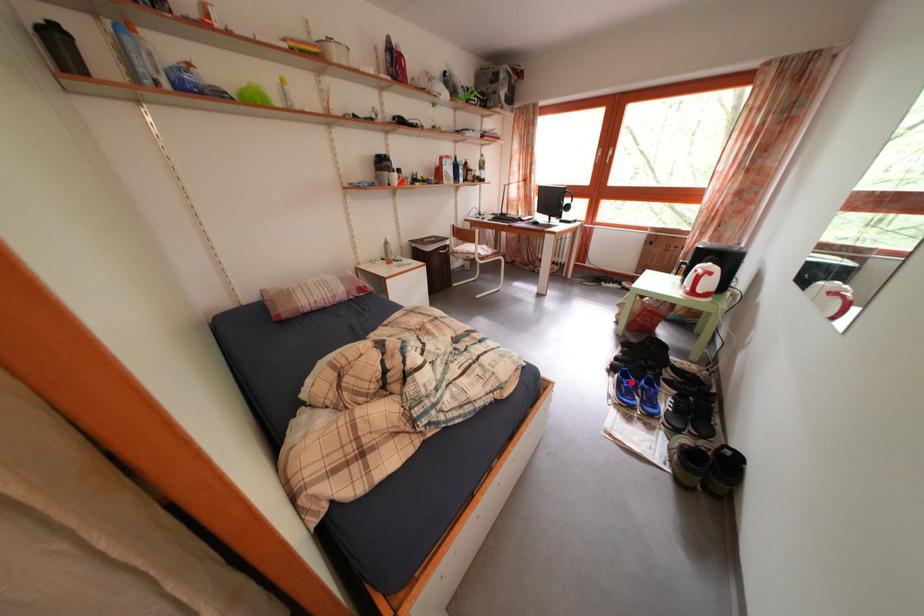
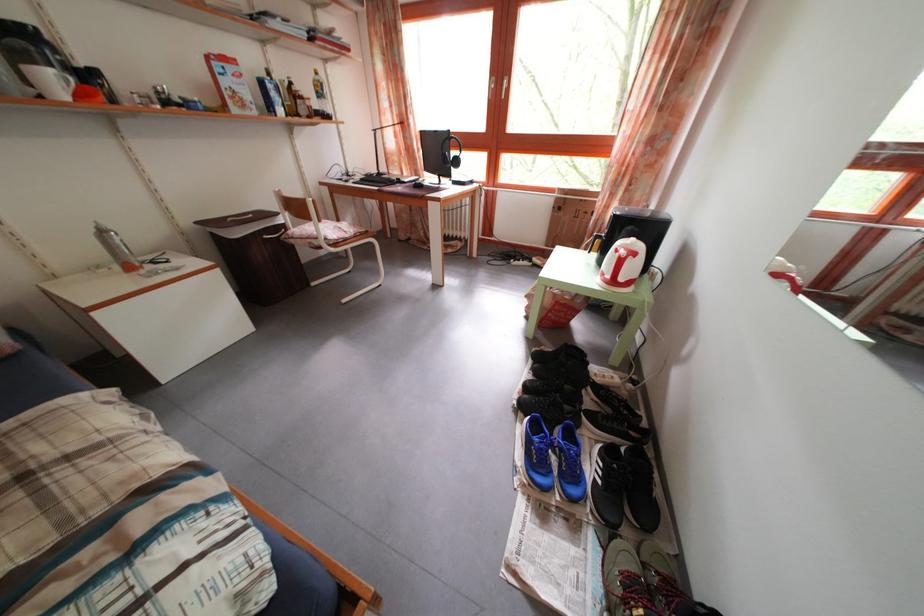
Question: I am providing you with two images of the same scene from different viewpoints. In image1, a red point is highlighted. Considering the same 3D point in image2, which of the following is correct?

Choices:
 (A) It is closer
 (B) It is farther

Answer: (B)